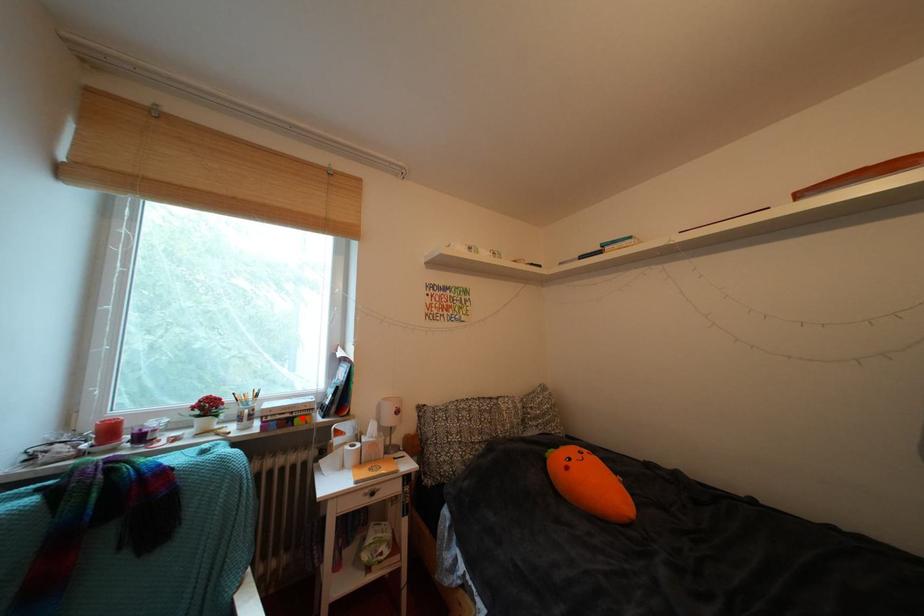
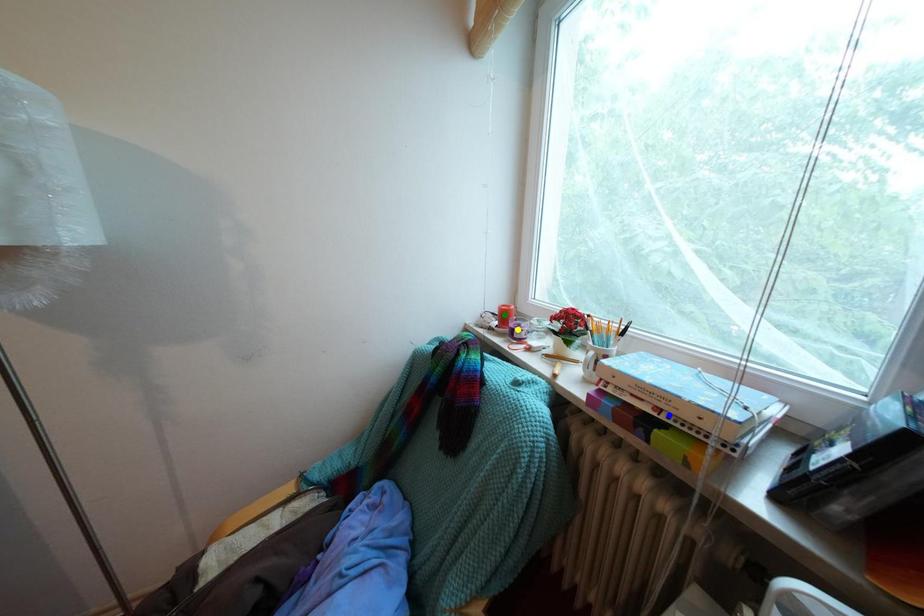
Question: I am providing you with two images of the same scene from different viewpoints. A red point is marked on the first image. You are given multiple points on the second image. In image 2, which mark is for the same physical point as the one in image 1?

Choices:
 (A) blue point
 (B) yellow point
 (C) green point

Answer: (A)